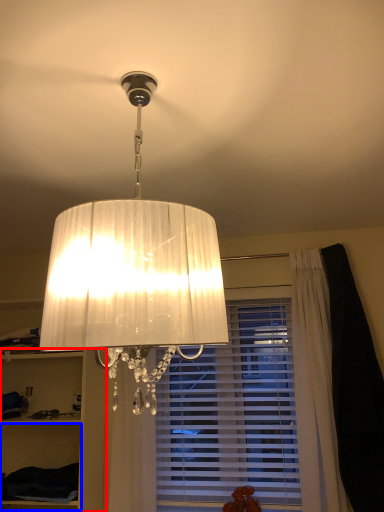
Question: Which object is further to the camera taking this photo, cabinet (highlighted by a red box) or cabinet (highlighted by a blue box)?

Choices:
 (A) cabinet
 (B) cabinet

Answer: (B)